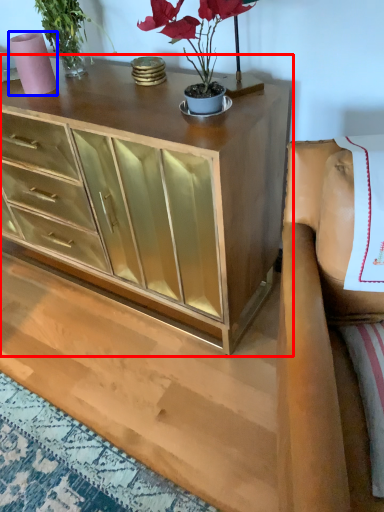
Question: Among these objects, which one is farthest to the camera, chest of drawers (highlighted by a red box) or vase (highlighted by a blue box)?

Choices:
 (A) chest of drawers
 (B) vase

Answer: (B)